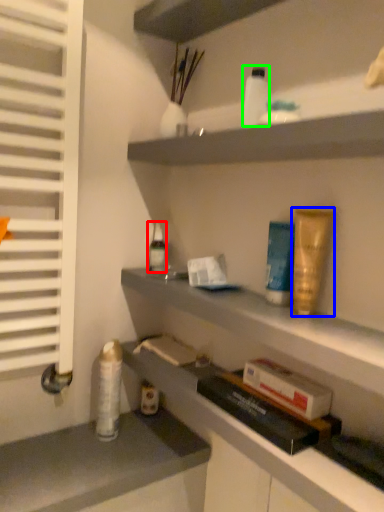
Question: Which is farther away from toiletry (highlighted by a red box)? toiletry (highlighted by a blue box) or toiletry (highlighted by a green box)?

Choices:
 (A) toiletry
 (B) toiletry

Answer: (A)